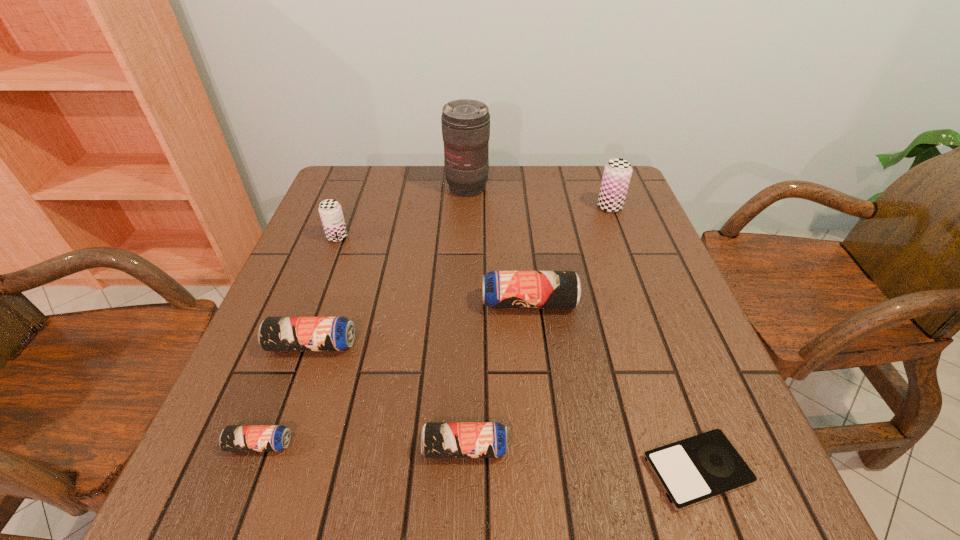
I want to click on the tallest object, so click(465, 123).

Identify the location of the rightmost beer can. The image size is (960, 540). (617, 173).

You are a GUI agent. You are given a task and a screenshot of the screen. Output one action in this format:
    pyautogui.click(x=<x>, y=<y>)
    Task: Click on the second tallest object
    Image resolution: width=960 pixels, height=540 pixels.
    Given the screenshot: What is the action you would take?
    pyautogui.click(x=617, y=173)

Find the location of a particular element. This screenshot has height=540, width=960. the second tallest beer can is located at coordinates (330, 211).

At what (x,y) coordinates should I click in order to perform the action: click on the nearer purple beer can. Please return your answer as a coordinate pair (x, y). Looking at the image, I should click on (330, 211).

Locate an element on the screen. The image size is (960, 540). the fourth farthest object is located at coordinates (501, 289).

Find the location of a particular element. the farthest blue beer can is located at coordinates pyautogui.click(x=501, y=289).

I want to click on the fifth tallest object, so click(x=275, y=333).

This screenshot has width=960, height=540. What are the coordinates of `the second farthest blue beer can` in the screenshot? It's located at (275, 333).

The height and width of the screenshot is (540, 960). Find the location of `the second smallest blue beer can`. the second smallest blue beer can is located at coordinates (438, 439).